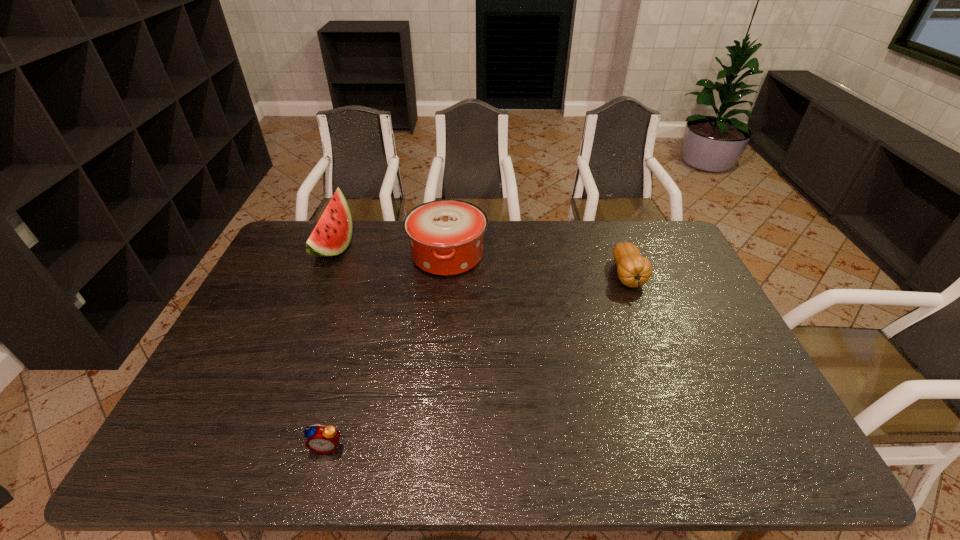
Identify the location of free point between the gourd and the casserole. Image resolution: width=960 pixels, height=540 pixels. (538, 266).

The width and height of the screenshot is (960, 540). In order to click on empty space that is in between the alarm clock and the watermelon in this screenshot , I will do `click(330, 347)`.

Where is `vacant area that lies between the third object from left to right and the leftmost object`? The image size is (960, 540). vacant area that lies between the third object from left to right and the leftmost object is located at coordinates (391, 252).

At what (x,y) coordinates should I click in order to perform the action: click on unoccupied area between the rightmost object and the casserole. Please return your answer as a coordinate pair (x, y). Looking at the image, I should click on (538, 266).

At what (x,y) coordinates should I click in order to perform the action: click on vacant space that's between the third object from left to right and the rightmost object. Please return your answer as a coordinate pair (x, y). Looking at the image, I should click on (538, 266).

Find the location of `vacant area that lies between the casserole and the second object from left to right`. vacant area that lies between the casserole and the second object from left to right is located at coordinates (388, 350).

Locate an element on the screen. The width and height of the screenshot is (960, 540). blank region between the leftmost object and the second object from right to left is located at coordinates (391, 252).

Locate an element on the screen. blank region between the rightmost object and the leftmost object is located at coordinates (481, 262).

Find the location of `vacant area that lies between the third object from right to left and the rightmost object`. vacant area that lies between the third object from right to left and the rightmost object is located at coordinates (477, 361).

Locate which object ranks third in proximity to the second object from right to left. Please provide its 2D coordinates. Your answer should be formatted as a tuple, i.e. [(x, y)], where the tuple contains the x and y coordinates of a point satisfying the conditions above.

[(322, 439)]